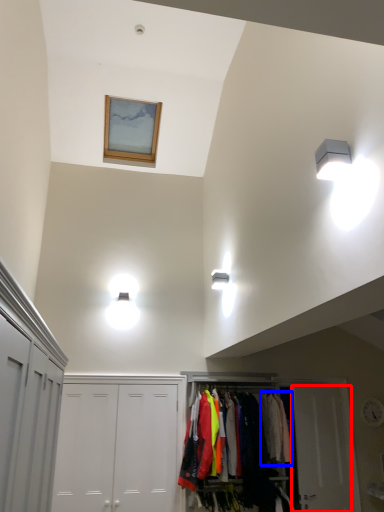
Question: Among these objects, which one is farthest to the camera, door (highlighted by a red box) or clothing (highlighted by a blue box)?

Choices:
 (A) door
 (B) clothing

Answer: (A)